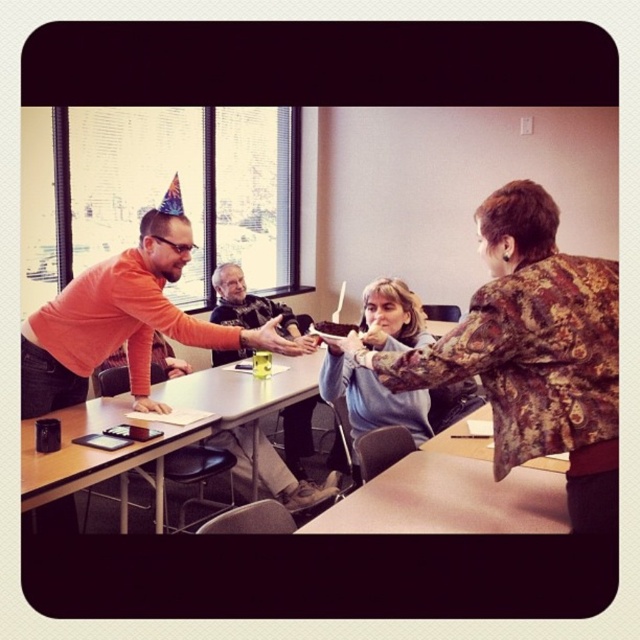
Is point (522, 308) more distant than point (419, 324)?

No, (522, 308) is closer to viewer.

Locate an element on the screen. This screenshot has width=640, height=640. floral-patterned blouse at center is located at coordinates (532, 352).

Which of these two, orange matte shirt at left or light blue sweater at center, stands taller?

Standing taller between the two is light blue sweater at center.

Is orange matte shirt at left thinner than light blue sweater at center?

Incorrect, orange matte shirt at left's width is not less than light blue sweater at center's.

Between point (90, 333) and point (401, 310), which one is positioned behind?

The point (401, 310) is behind.

I want to click on orange matte shirt at left, so click(x=124, y=323).

Which of these two, floral-patterned blouse at center or black plastic table at lower left, stands shorter?

Standing shorter between the two is black plastic table at lower left.

Between floral-patterned blouse at center and black plastic table at lower left, which one is positioned higher?

floral-patterned blouse at center is higher up.

Is point (403, 378) behind point (157, 442)?

No, it is not.

The width and height of the screenshot is (640, 640). What are the coordinates of `floral-patterned blouse at center` in the screenshot? It's located at (532, 352).